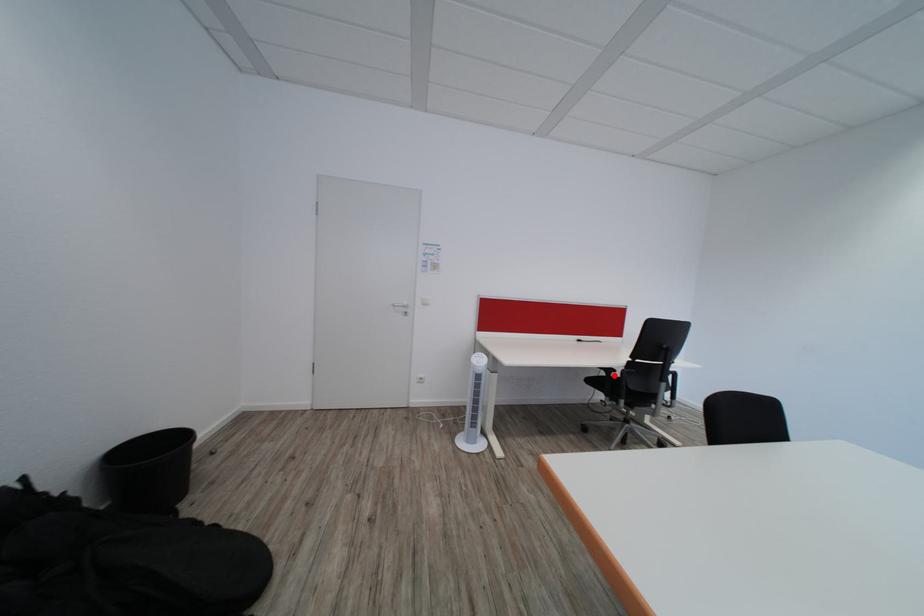
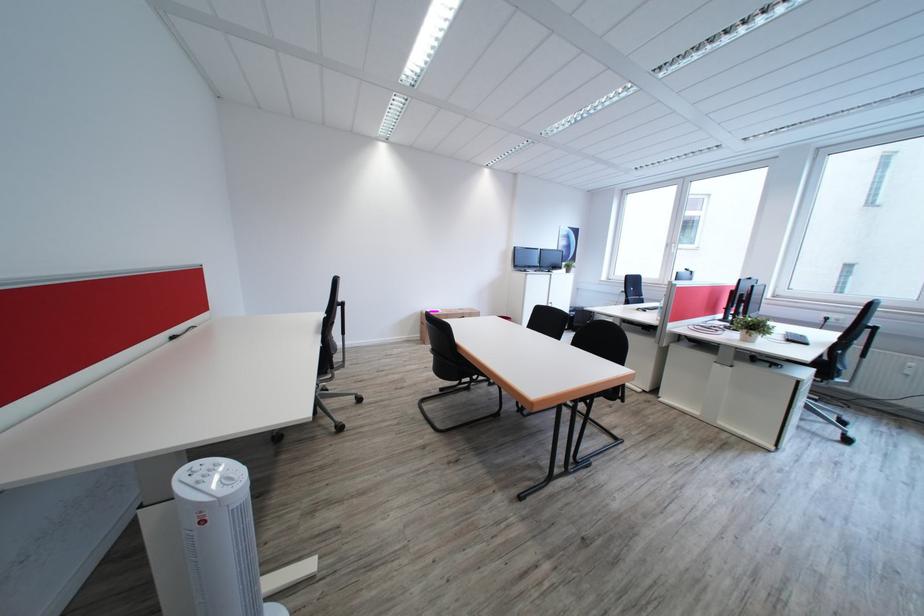
Question: I am providing you with two images of the same scene from different viewpoints. A red point is marked on the first image. Is the red point's position out of view in image 2?

Choices:
 (A) Yes
 (B) No

Answer: (A)